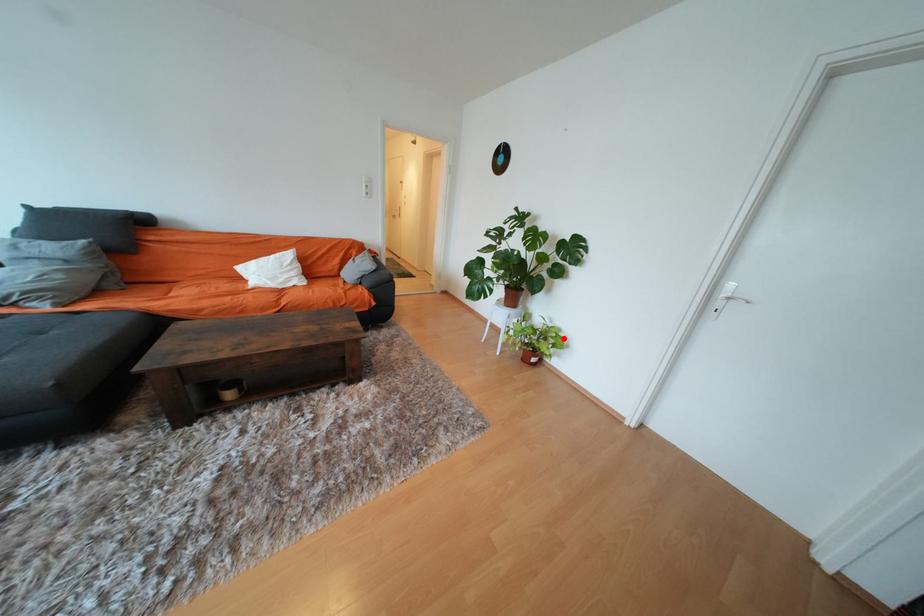
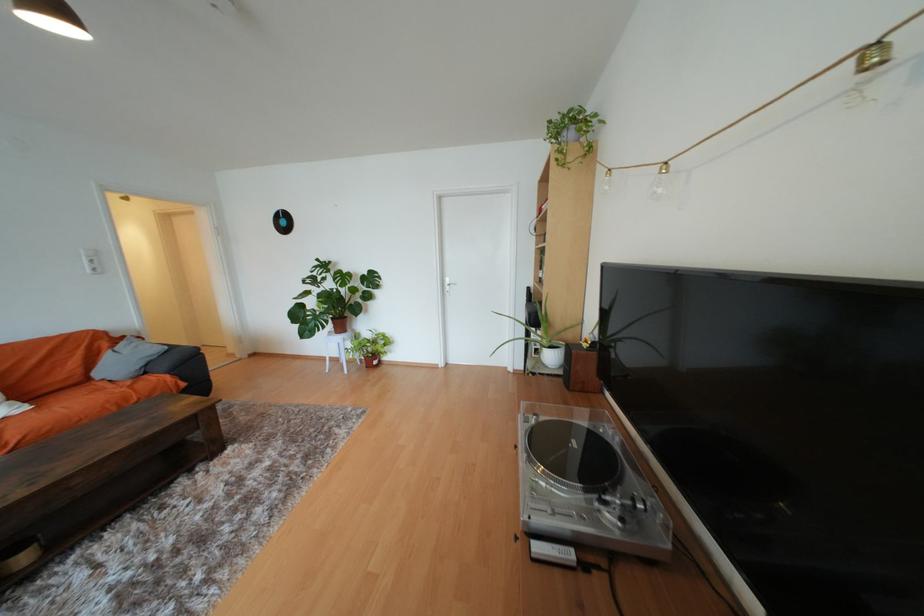
Find the pixel in the second image that matches the highlighted location in the first image.

(391, 339)